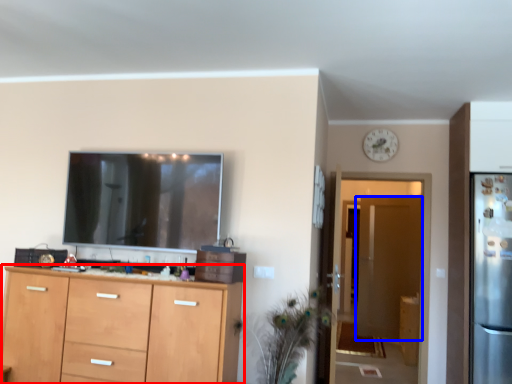
Question: Which of the following is the farthest to the observer, cabinetry (highlighted by a red box) or door (highlighted by a blue box)?

Choices:
 (A) cabinetry
 (B) door

Answer: (B)